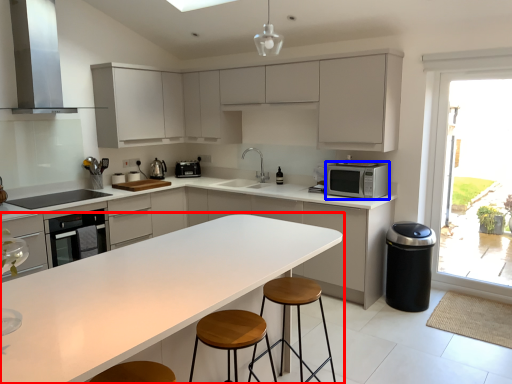
Question: Among these objects, which one is nearest to the camera, countertop (highlighted by a red box) or microwave oven (highlighted by a blue box)?

Choices:
 (A) countertop
 (B) microwave oven

Answer: (A)